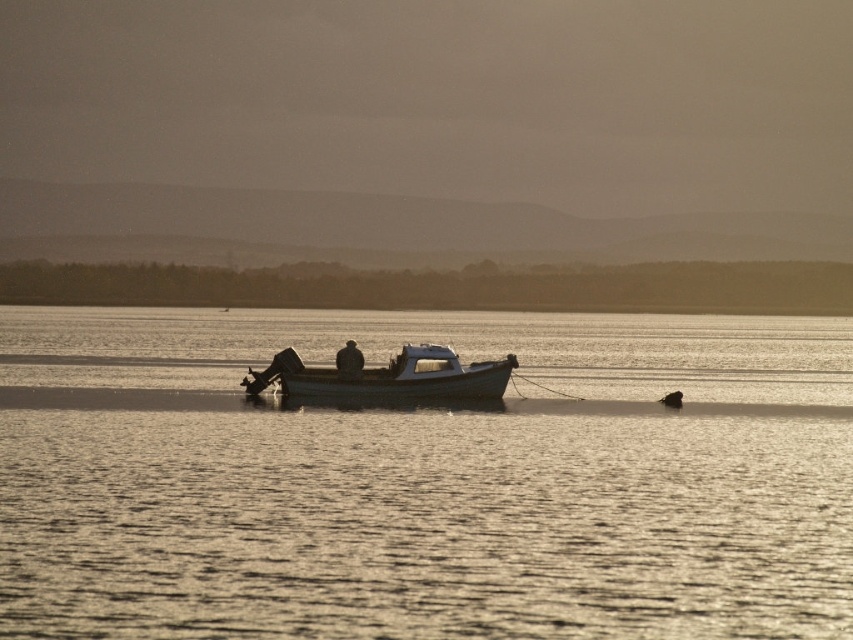
Question: Does silvery reflective water at center have a larger size compared to dark textured jacket at center?

Choices:
 (A) no
 (B) yes

Answer: (B)

Question: Considering the real-world distances, which object is farthest from the white matte boat at center?

Choices:
 (A) silvery reflective water at center
 (B) dark textured jacket at center

Answer: (A)

Question: Which object is positioned closest to the white matte boat at center?

Choices:
 (A) dark textured jacket at center
 (B) silvery reflective water at center

Answer: (A)

Question: Which is nearer to the silvery reflective water at center?

Choices:
 (A) dark textured jacket at center
 (B) white matte boat at center

Answer: (B)

Question: Can you confirm if silvery reflective water at center is smaller than white matte boat at center?

Choices:
 (A) no
 (B) yes

Answer: (A)

Question: Is white matte boat at center bigger than dark textured jacket at center?

Choices:
 (A) no
 (B) yes

Answer: (B)